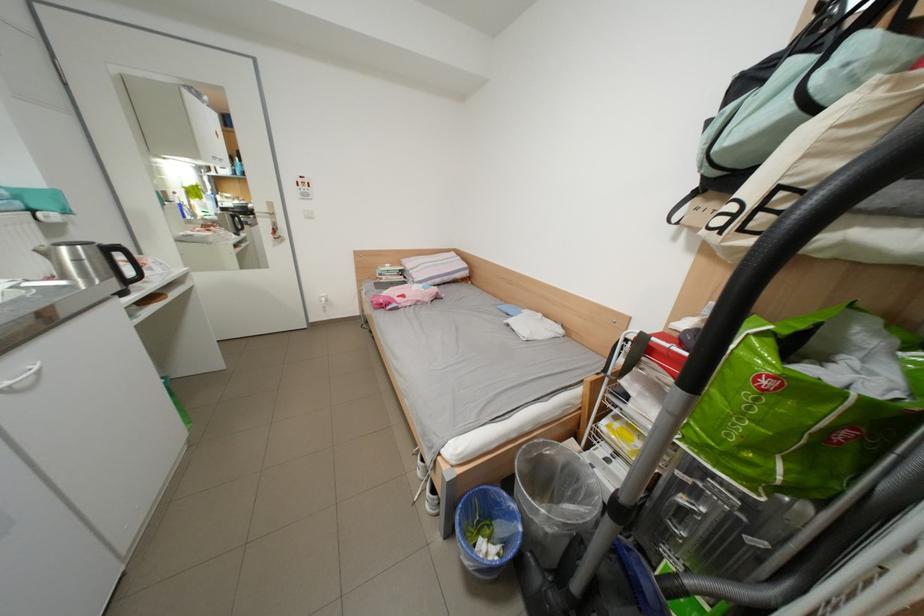
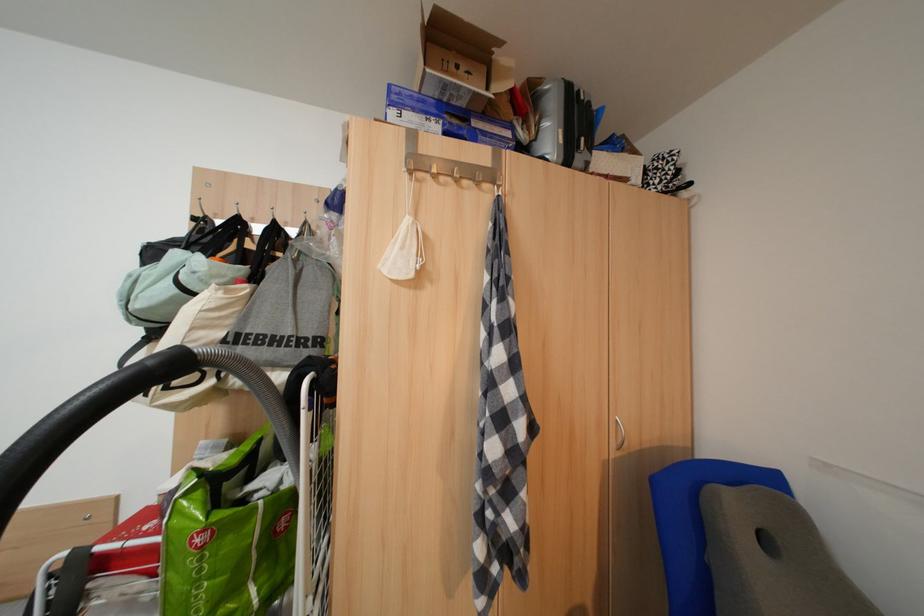
Where in the second image is the point corresponding to point (754, 448) from the first image?

(225, 610)